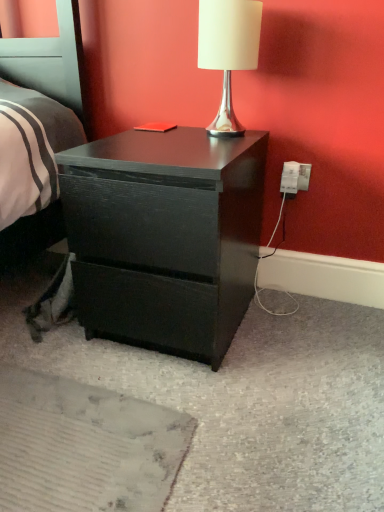
Question: Is white plastic electric outlet at lower right at the right side of white glossy table lamp at upper center?

Choices:
 (A) no
 (B) yes

Answer: (B)

Question: From the image's perspective, would you say white plastic electric outlet at lower right is positioned over white glossy table lamp at upper center?

Choices:
 (A) yes
 (B) no

Answer: (B)

Question: Can you confirm if white plastic electric outlet at lower right is positioned to the left of white glossy table lamp at upper center?

Choices:
 (A) no
 (B) yes

Answer: (A)

Question: Is white plastic electric outlet at lower right shorter than white glossy table lamp at upper center?

Choices:
 (A) yes
 (B) no

Answer: (A)

Question: Is white plastic electric outlet at lower right in front of white glossy table lamp at upper center?

Choices:
 (A) yes
 (B) no

Answer: (B)

Question: From the image's perspective, is white plastic electric outlet at lower right located beneath white glossy table lamp at upper center?

Choices:
 (A) yes
 (B) no

Answer: (A)

Question: Can you confirm if white glossy table lamp at upper center is smaller than matte black nightstand at center?

Choices:
 (A) yes
 (B) no

Answer: (A)

Question: Is white glossy table lamp at upper center positioned in front of matte black nightstand at center?

Choices:
 (A) yes
 (B) no

Answer: (B)

Question: Is white glossy table lamp at upper center oriented towards matte black nightstand at center?

Choices:
 (A) yes
 (B) no

Answer: (B)

Question: Does white glossy table lamp at upper center have a lesser width compared to matte black nightstand at center?

Choices:
 (A) yes
 (B) no

Answer: (A)

Question: Does white glossy table lamp at upper center have a larger size compared to matte black nightstand at center?

Choices:
 (A) no
 (B) yes

Answer: (A)

Question: Does white glossy table lamp at upper center appear on the right side of matte black nightstand at center?

Choices:
 (A) no
 (B) yes

Answer: (B)

Question: From a real-world perspective, does white plastic electric outlet at lower right stand above matte black nightstand at center?

Choices:
 (A) no
 (B) yes

Answer: (B)